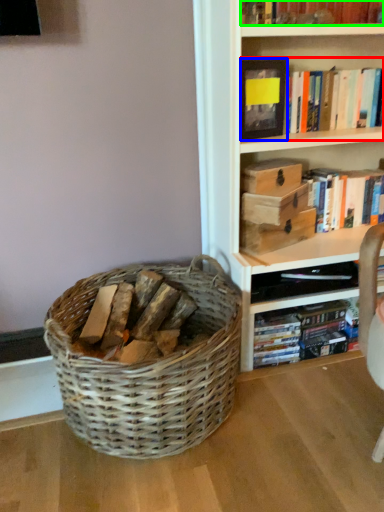
Question: Which object is the farthest from book (highlighted by a red box)? Choose among these: paperback book (highlighted by a blue box) or book (highlighted by a green box).

Choices:
 (A) paperback book
 (B) book

Answer: (B)